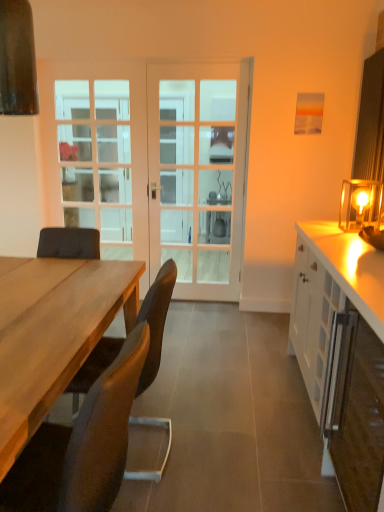
Question: Is white glass screen door at center facing away from brown leather chair at lower left, which is the second chair in front-to-back order?

Choices:
 (A) yes
 (B) no

Answer: (B)

Question: From the image's perspective, is white glass screen door at center on top of brown leather chair at lower left, which is the second chair in front-to-back order?

Choices:
 (A) no
 (B) yes

Answer: (B)

Question: Does white glass screen door at center have a greater width compared to brown leather chair at lower left, which is the second chair in front-to-back order?

Choices:
 (A) no
 (B) yes

Answer: (A)

Question: From a real-world perspective, does white glass screen door at center sit lower than brown leather chair at lower left, the first chair positioned from the back?

Choices:
 (A) no
 (B) yes

Answer: (A)

Question: From the image's perspective, is white glass screen door at center under brown leather chair at lower left, which is the second chair in front-to-back order?

Choices:
 (A) no
 (B) yes

Answer: (A)

Question: Is white glossy cabinet at right, which is counted as the 1th cabinetry, starting from the back, inside the boundaries of white glass door at center, or outside?

Choices:
 (A) outside
 (B) inside

Answer: (A)

Question: In the image, is white glossy cabinet at right, positioned as the second cabinetry in front-to-back order, positioned in front of or behind white glass door at center?

Choices:
 (A) behind
 (B) front

Answer: (B)

Question: In terms of size, does white glossy cabinet at right, positioned as the second cabinetry in front-to-back order, appear bigger or smaller than white glass door at center?

Choices:
 (A) big
 (B) small

Answer: (A)

Question: From the image's perspective, is white glossy cabinet at right, positioned as the second cabinetry in front-to-back order, above or below white glass door at center?

Choices:
 (A) above
 (B) below

Answer: (B)

Question: Visually, is clear glass door at center positioned to the left or to the right of brown leather chair at lower left, the first chair positioned from the back?

Choices:
 (A) left
 (B) right

Answer: (A)

Question: Choose the correct answer: Is clear glass door at center inside brown leather chair at lower left, which is the second chair in front-to-back order, or outside it?

Choices:
 (A) inside
 (B) outside

Answer: (B)

Question: Considering the positions of point (66, 117) and point (114, 347), is point (66, 117) closer or farther from the camera than point (114, 347)?

Choices:
 (A) farther
 (B) closer

Answer: (A)

Question: Is clear glass door at center in front of or behind brown leather chair at lower left, the first chair positioned from the back, in the image?

Choices:
 (A) behind
 (B) front

Answer: (A)

Question: From the image's perspective, is white glass door at center positioned above or below white glossy cabinet at right, which is counted as the 1th cabinetry, starting from the back?

Choices:
 (A) above
 (B) below

Answer: (A)

Question: Which is correct: white glass door at center is inside white glossy cabinet at right, which is counted as the 1th cabinetry, starting from the back, or outside of it?

Choices:
 (A) outside
 (B) inside

Answer: (A)